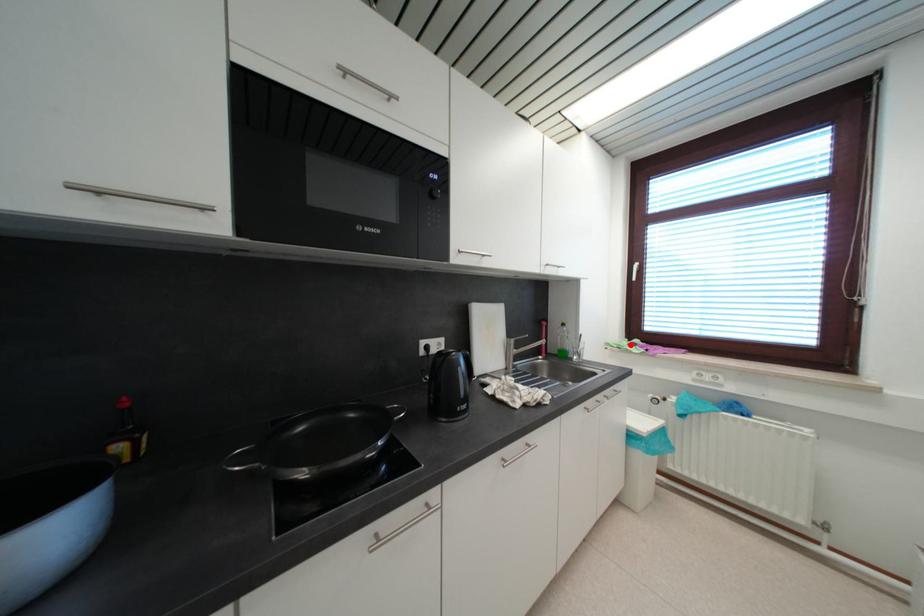
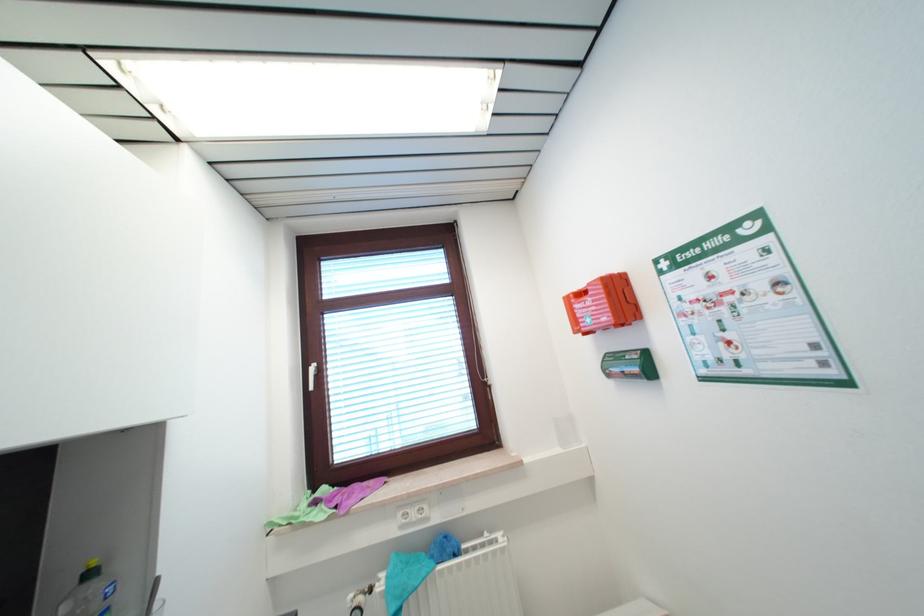
The point at the highlighted location is marked in the first image. Where is the corresponding point in the second image?

(311, 501)